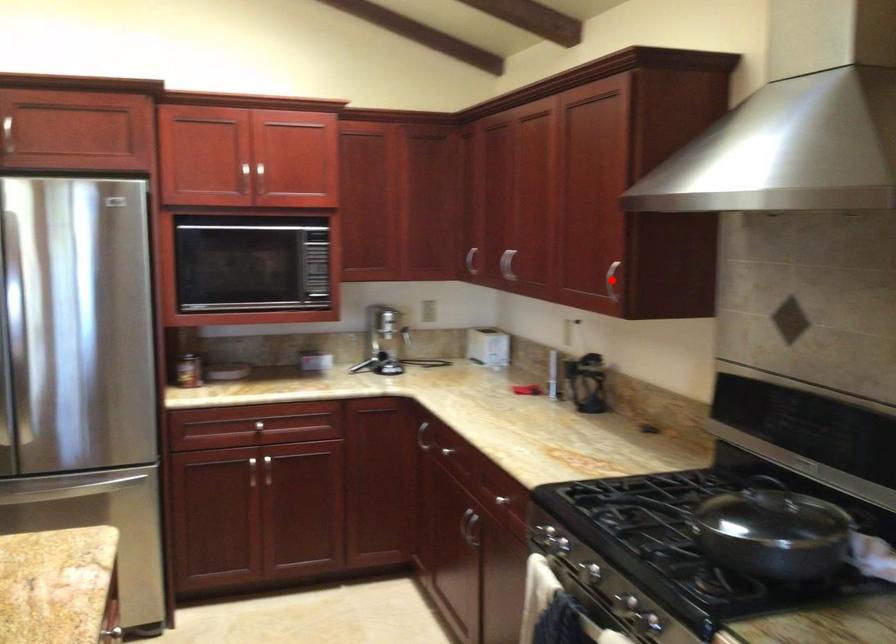
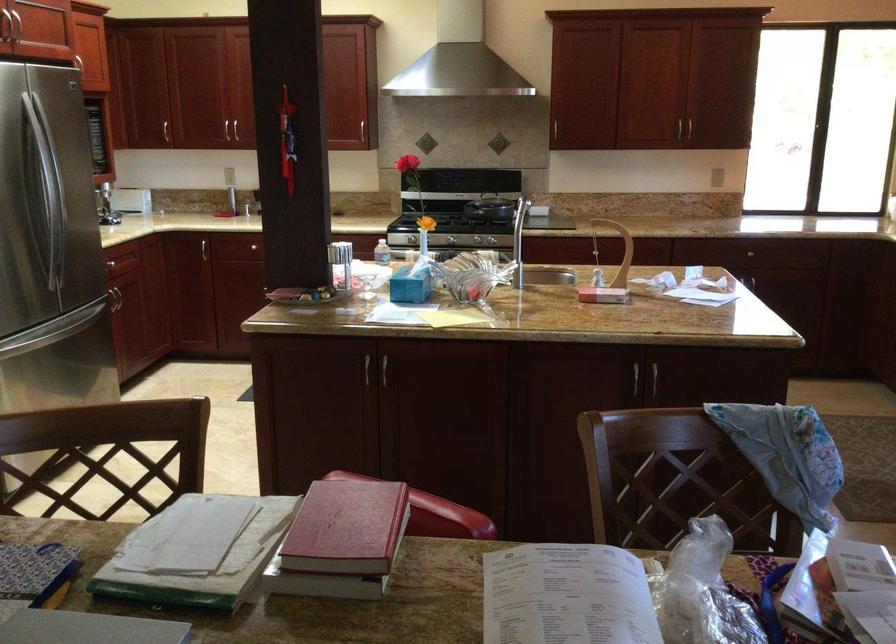
Question: I am providing you with two images of the same scene from different viewpoints. A red point is marked on the first image. Can you still see the location of the red point in image 2?

Choices:
 (A) Yes
 (B) No

Answer: (B)